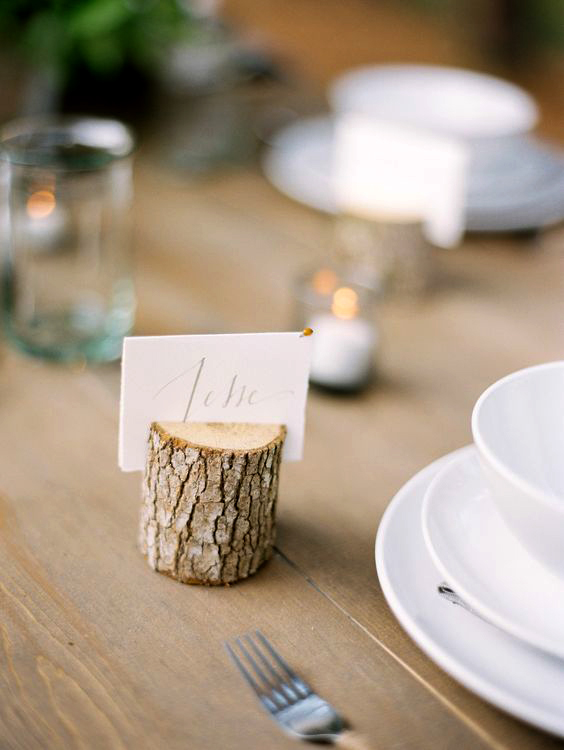
Identify the location of glass. (45, 208).